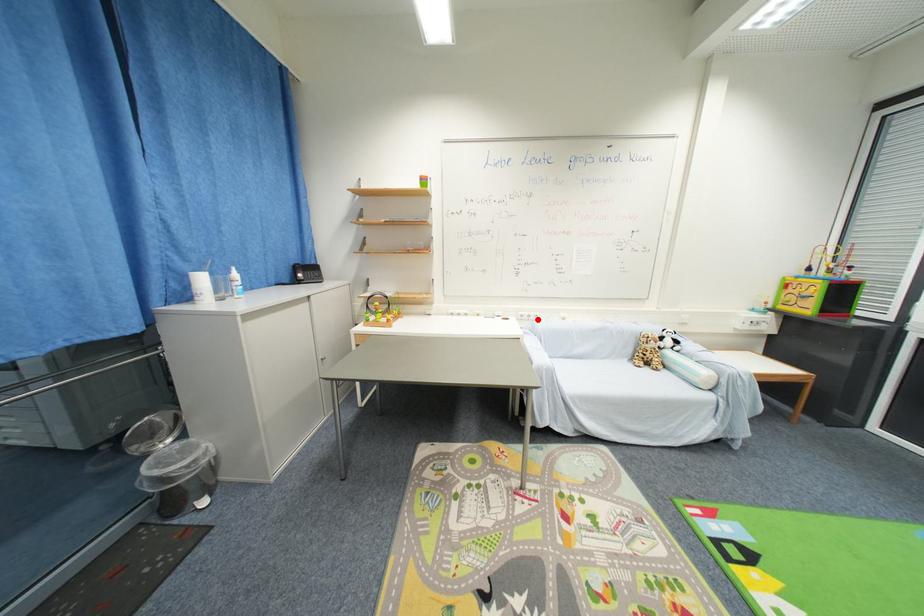
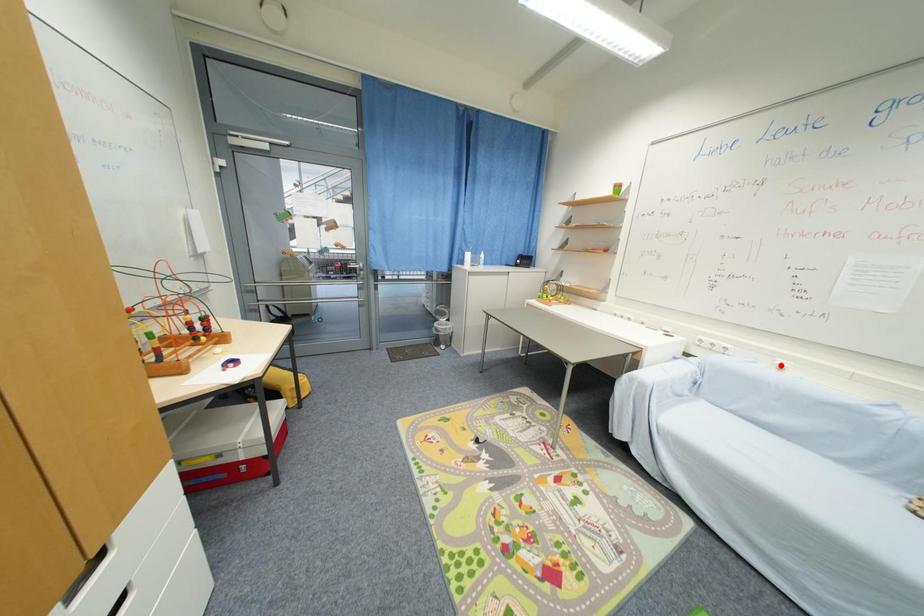
I am providing you with two images of the same scene from different viewpoints. A red point is marked on the first image and another point is marked on the second image. Does the point marked in image1 correspond to the same location as the one in image2?

No